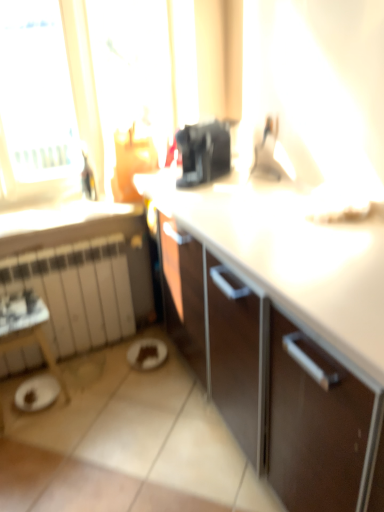
I want to click on vacant space that is in between brown matte plate at lower center and white matte radiator at lower left, so click(100, 367).